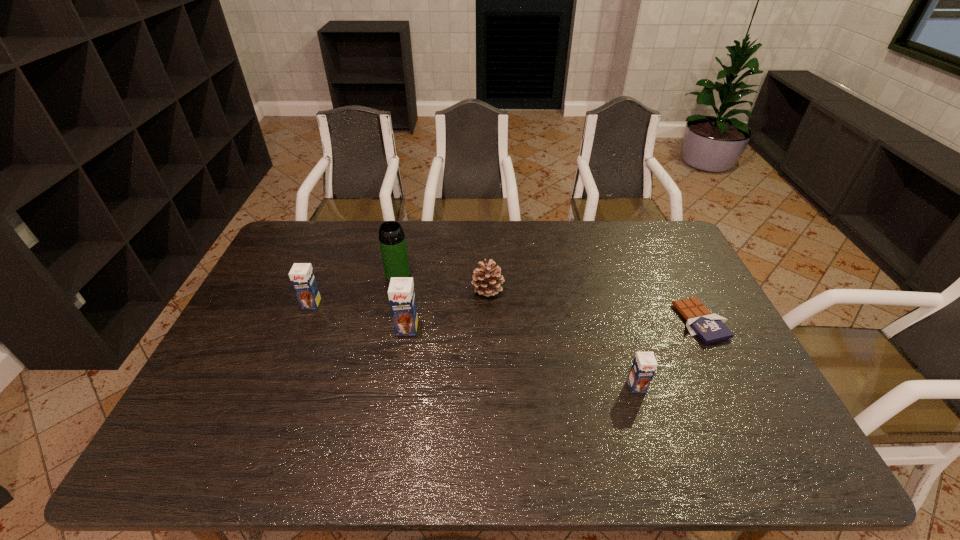
Identify the location of vacant space at the right edge of the desktop. (689, 279).

In the image, there is a desktop. Where is `vacant space at the far right corner`? The width and height of the screenshot is (960, 540). vacant space at the far right corner is located at coordinates (657, 260).

You are a GUI agent. You are given a task and a screenshot of the screen. Output one action in this format:
    pyautogui.click(x=<x>, y=<y>)
    Task: Click on the vacant space in between the rightmost chocolate milk and the second shortest chocolate milk
    The image size is (960, 540).
    Given the screenshot: What is the action you would take?
    pyautogui.click(x=474, y=345)

Image resolution: width=960 pixels, height=540 pixels. I want to click on vacant region between the tallest chocolate milk and the leftmost chocolate milk, so click(x=359, y=316).

I want to click on unoccupied position between the second chocolate milk from right to left and the third object from right to left, so click(x=447, y=309).

What are the coordinates of `blank region between the rightmost object and the nearest object` in the screenshot? It's located at (669, 354).

Locate an element on the screen. The width and height of the screenshot is (960, 540). unoccupied position between the shortest chocolate milk and the leftmost object is located at coordinates (474, 345).

You are a GUI agent. You are given a task and a screenshot of the screen. Output one action in this format:
    pyautogui.click(x=<x>, y=<y>)
    Task: Click on the unoccupied position between the fifth object from left to right and the second tallest object
    
    Given the screenshot: What is the action you would take?
    pyautogui.click(x=522, y=357)

Find the location of `vacant point located between the second nearest chocolate milk and the farthest chocolate milk`. vacant point located between the second nearest chocolate milk and the farthest chocolate milk is located at coordinates (359, 316).

The width and height of the screenshot is (960, 540). What are the coordinates of `free space between the rightmost chocolate milk and the fourth object from left to right` in the screenshot? It's located at (563, 338).